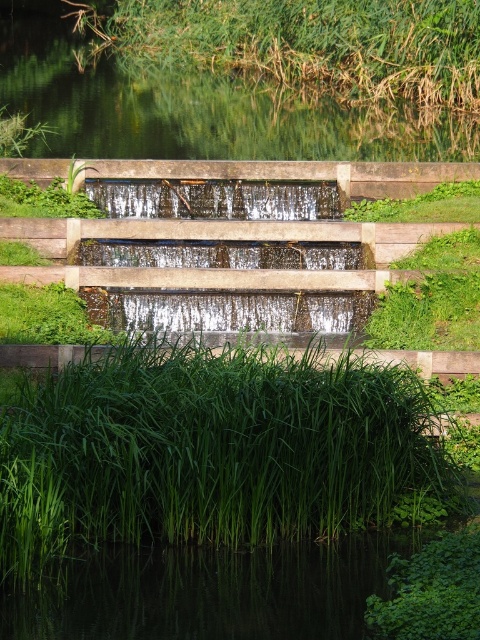
Looking at this image, you are standing in front of the waterfall and notice two areas of green grass. The first is the green leafy grass at lower center, and the second is the green grass at upper left. Which of these two grass areas is located lower in the image?

The green leafy grass at lower center is positioned under the green grass at upper left, so it is located lower in the image.

You are a gardener who wants to plant new flowers between the green leafy grass at lower center and the green grass at upper left. Which area has more space to accommodate larger flowers?

The green grass at upper left is larger than the green leafy grass at lower center, so it has more space to accommodate larger flowers.